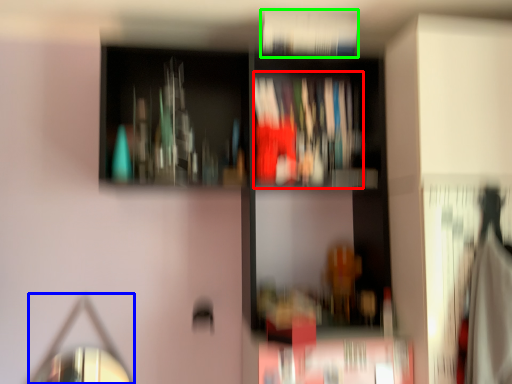
Question: Considering the real-world distances, which object is closest to book (highlighted by a red box)? mirror (highlighted by a blue box) or book (highlighted by a green box).

Choices:
 (A) mirror
 (B) book

Answer: (B)